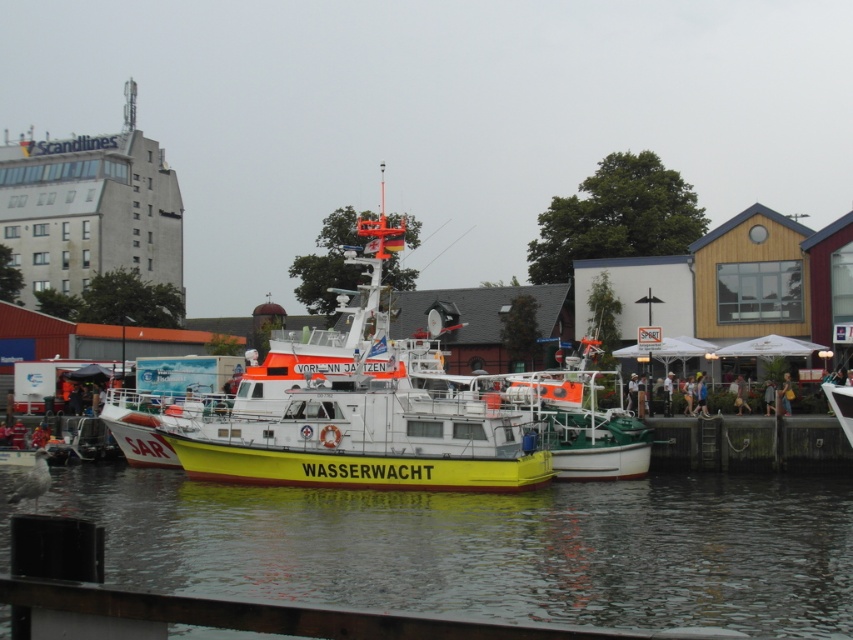
Question: Considering the relative positions of yellow matte water at center and yellow matte boat at center in the image provided, where is yellow matte water at center located with respect to yellow matte boat at center?

Choices:
 (A) above
 (B) below

Answer: (B)

Question: Is yellow matte water at center to the right of yellow matte boat at center from the viewer's perspective?

Choices:
 (A) yes
 (B) no

Answer: (A)

Question: Is yellow matte water at center below yellow matte boat at center?

Choices:
 (A) yes
 (B) no

Answer: (A)

Question: Among these points, which one is farthest from the camera?

Choices:
 (A) (480, 419)
 (B) (844, 612)

Answer: (A)

Question: Among these objects, which one is nearest to the camera?

Choices:
 (A) yellow matte water at center
 (B) yellow matte boat at center

Answer: (A)